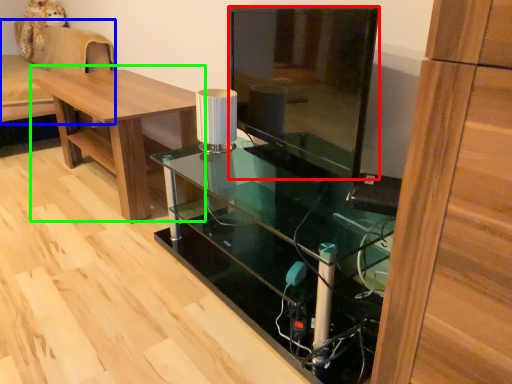
Question: Which is nearer to the glass door (highlighted by a red box)? couch (highlighted by a blue box) or table (highlighted by a green box).

Choices:
 (A) couch
 (B) table

Answer: (B)